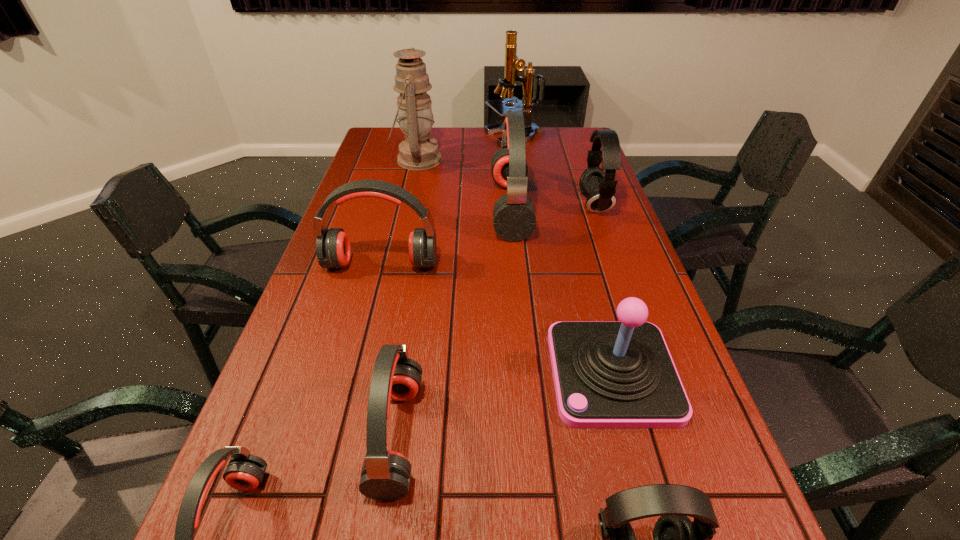
Locate an element on the screen. Image resolution: width=960 pixels, height=540 pixels. gold microscope is located at coordinates (513, 64).

The image size is (960, 540). I want to click on oil lamp, so click(x=419, y=152).

Locate an element on the screen. This screenshot has width=960, height=540. the biggest red earphone is located at coordinates (514, 219).

You are a GUI agent. You are given a task and a screenshot of the screen. Output one action in this format:
    pyautogui.click(x=<x>, y=<y>)
    Task: Click on the farthest red earphone
    
    Given the screenshot: What is the action you would take?
    514,219

The height and width of the screenshot is (540, 960). Find the location of `the fifth nearest object`. the fifth nearest object is located at coordinates (333, 249).

Find the location of a particular element. the second farthest red earphone is located at coordinates (333, 249).

Identify the location of the bigger black earphone. (598, 186).

Locate an element on the screen. This screenshot has height=540, width=960. joystick is located at coordinates (607, 374).

Locate an element on the screen. the second smallest red earphone is located at coordinates (385, 476).

Where is `vacant space located at the eyepiece of the gold microscope`? vacant space located at the eyepiece of the gold microscope is located at coordinates (406, 137).